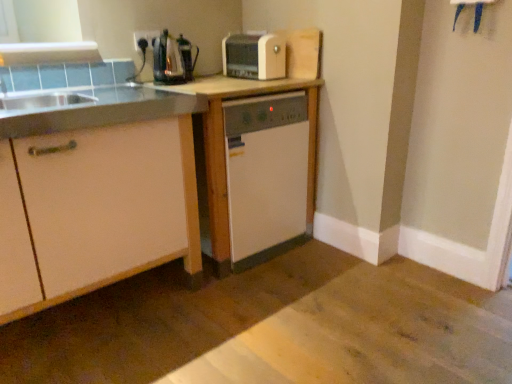
What do you see at coordinates (145, 38) in the screenshot? Image resolution: width=512 pixels, height=384 pixels. I see `matte plastic outlet at upper left` at bounding box center [145, 38].

Describe the element at coordinates (224, 144) in the screenshot. I see `white wood table at center` at that location.

The image size is (512, 384). In order to click on white plastic toaster at upper center in this screenshot , I will do `click(254, 56)`.

The image size is (512, 384). What do you see at coordinates (106, 206) in the screenshot? I see `white matte cabinet at left` at bounding box center [106, 206].

The image size is (512, 384). Identify the location of matte plastic outlet at upper left. (145, 38).

Could you tell me if matte plastic outlet at upper left is facing satin silver coffee machine at upper center?

Yes.

Does matte plastic outlet at upper left contain satin silver coffee machine at upper center?

No, satin silver coffee machine at upper center is not a part of matte plastic outlet at upper left.

Consider the image. From the image's perspective, which is below, matte plastic outlet at upper left or satin silver coffee machine at upper center?

satin silver coffee machine at upper center, from the image's perspective.

From a real-world perspective, who is located lower, satin silver coffee machine at upper center or white wood table at center?

In real-world perspective, white wood table at center is lower.

In the scene shown: Who is more distant, satin silver coffee machine at upper center or white wood table at center?

satin silver coffee machine at upper center.

You are a GUI agent. You are given a task and a screenshot of the screen. Output one action in this format:
    pyautogui.click(x=<x>, y=<y>)
    Task: Click on the table on the right of satin silver coffee machine at upper center
    Image resolution: width=512 pixels, height=384 pixels.
    Given the screenshot: What is the action you would take?
    pyautogui.click(x=224, y=144)

Would you say satin silver coffee machine at upper center contains white wood table at center?

No.

Is white matte cabinet at left in contact with matte plastic outlet at upper left?

No, white matte cabinet at left is not in contact with matte plastic outlet at upper left.

From their relative heights in the image, would you say white matte cabinet at left is taller or shorter than matte plastic outlet at upper left?

Clearly, white matte cabinet at left is taller compared to matte plastic outlet at upper left.

Where is `electric outlet that appears above the white matte cabinet at left (from the image's perspective)`? Image resolution: width=512 pixels, height=384 pixels. electric outlet that appears above the white matte cabinet at left (from the image's perspective) is located at coordinates (145, 38).

Is white matte cabinet at left bigger than matte plastic outlet at upper left?

Indeed, white matte cabinet at left has a larger size compared to matte plastic outlet at upper left.

Is white plastic toaster at upper center far away from satin silver coffee machine at upper center?

That's not correct — white plastic toaster at upper center is a little close to satin silver coffee machine at upper center.

Is white plastic toaster at upper center closer to camera compared to satin silver coffee machine at upper center?

No, it is behind satin silver coffee machine at upper center.

What's the angular difference between white plastic toaster at upper center and satin silver coffee machine at upper center's facing directions?

36.2 degrees separate the facing orientations of white plastic toaster at upper center and satin silver coffee machine at upper center.

Is white plastic toaster at upper center looking in the opposite direction of satin silver coffee machine at upper center?

No, white plastic toaster at upper center is not facing away from satin silver coffee machine at upper center.

Choose the correct answer: Is white plastic toaster at upper center inside white wood table at center or outside it?

The correct answer is: outside.

Which object is further away from the camera taking this photo, white plastic toaster at upper center or white wood table at center?

Positioned behind is white plastic toaster at upper center.

Is point (274, 38) closer to camera compared to point (219, 101)?

No.

Which object is positioned more to the left, white plastic toaster at upper center or white wood table at center?

white wood table at center is more to the left.

Which object is positioned more to the right, satin silver coffee machine at upper center or white plastic toaster at upper center?

Positioned to the right is white plastic toaster at upper center.

Consider the image. Looking at their sizes, would you say satin silver coffee machine at upper center is wider or thinner than white plastic toaster at upper center?

Considering their sizes, satin silver coffee machine at upper center looks slimmer than white plastic toaster at upper center.

Is satin silver coffee machine at upper center far away from white plastic toaster at upper center?

Actually, satin silver coffee machine at upper center and white plastic toaster at upper center are a little close together.

Is satin silver coffee machine at upper center smaller than white plastic toaster at upper center?

Correct, satin silver coffee machine at upper center occupies less space than white plastic toaster at upper center.

Does white wood table at center contain white plastic toaster at upper center?

No, white plastic toaster at upper center is not surrounded by white wood table at center.

From the image's perspective, is white wood table at center on top of white plastic toaster at upper center?

No.

Considering their positions, is white wood table at center located in front of or behind white plastic toaster at upper center?

In the image, white wood table at center appears in front of white plastic toaster at upper center.

Is white wood table at center smaller than white plastic toaster at upper center?

Actually, white wood table at center might be larger than white plastic toaster at upper center.

This screenshot has height=384, width=512. Identify the location of electric outlet on the left side of satin silver coffee machine at upper center. (145, 38).

Where is `table that appears below the satin silver coffee machine at upper center (from the image's perspective)`? This screenshot has width=512, height=384. table that appears below the satin silver coffee machine at upper center (from the image's perspective) is located at coordinates (224, 144).

When comparing their distances from white plastic toaster at upper center, does matte plastic outlet at upper left or satin silver coffee machine at upper center seem closer?

satin silver coffee machine at upper center is positioned closer to the anchor white plastic toaster at upper center.

Estimate the real-world distances between objects in this image. Which object is closer to white matte cabinet at left, matte plastic outlet at upper left or satin silver coffee machine at upper center?

satin silver coffee machine at upper center is positioned closer to the anchor white matte cabinet at left.

When comparing their distances from matte plastic outlet at upper left, does satin silver coffee machine at upper center or white plastic toaster at upper center seem closer?

satin silver coffee machine at upper center lies closer to matte plastic outlet at upper left than the other object.

Consider the image. Considering their positions, is white matte cabinet at left positioned further to satin silver coffee machine at upper center than white wood table at center?

white matte cabinet at left lies further to satin silver coffee machine at upper center than the other object.

Based on their spatial positions, is matte plastic outlet at upper left or white plastic toaster at upper center closer to satin silver coffee machine at upper center?

matte plastic outlet at upper left lies closer to satin silver coffee machine at upper center than the other object.

Considering their positions, is white matte cabinet at left positioned closer to white wood table at center than matte plastic outlet at upper left?

Based on the image, white matte cabinet at left appears to be nearer to white wood table at center.

From the image, which object appears to be farther from white wood table at center, white plastic toaster at upper center or matte plastic outlet at upper left?

Among the two, matte plastic outlet at upper left is located further to white wood table at center.

Considering their positions, is white wood table at center positioned closer to white matte cabinet at left than matte plastic outlet at upper left?

white wood table at center lies closer to white matte cabinet at left than the other object.

Locate an element on the screen. kitchen appliance that lies between matte plastic outlet at upper left and white wood table at center from top to bottom is located at coordinates (254, 56).

Image resolution: width=512 pixels, height=384 pixels. Identify the location of kitchen appliance located between white matte cabinet at left and matte plastic outlet at upper left in the depth direction. (254, 56).

The image size is (512, 384). What are the coordinates of `coffee machine between white matte cabinet at left and matte plastic outlet at upper left along the z-axis` in the screenshot? It's located at (172, 59).

Identify the location of table between white matte cabinet at left and satin silver coffee machine at upper center from front to back. (224, 144).